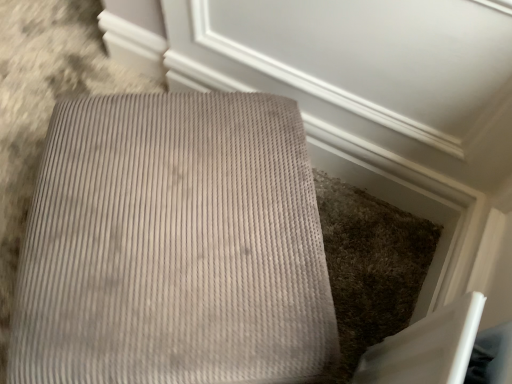
Question: Is matte gray carpet at upper center in front of or behind beige corduroy ottoman at center in the image?

Choices:
 (A) behind
 (B) front

Answer: (A)

Question: Visually, is matte gray carpet at upper center positioned to the left or to the right of beige corduroy ottoman at center?

Choices:
 (A) right
 (B) left

Answer: (A)

Question: Looking at the image, does matte gray carpet at upper center seem bigger or smaller compared to beige corduroy ottoman at center?

Choices:
 (A) big
 (B) small

Answer: (B)

Question: Looking at their shapes, would you say beige corduroy ottoman at center is wider or thinner than matte gray carpet at upper center?

Choices:
 (A) wide
 (B) thin

Answer: (A)

Question: From the image's perspective, is beige corduroy ottoman at center located above or below matte gray carpet at upper center?

Choices:
 (A) below
 (B) above

Answer: (A)

Question: From a real-world perspective, is beige corduroy ottoman at center above or below matte gray carpet at upper center?

Choices:
 (A) above
 (B) below

Answer: (B)

Question: In the image, is beige corduroy ottoman at center on the left side or the right side of matte gray carpet at upper center?

Choices:
 (A) left
 (B) right

Answer: (A)